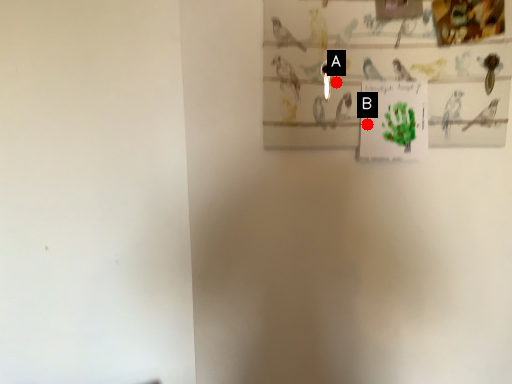
Question: Two points are circled on the image, labeled by A and B beside each circle. Which point appears closest to the camera in this image?

Choices:
 (A) A is closer
 (B) B is closer

Answer: (A)